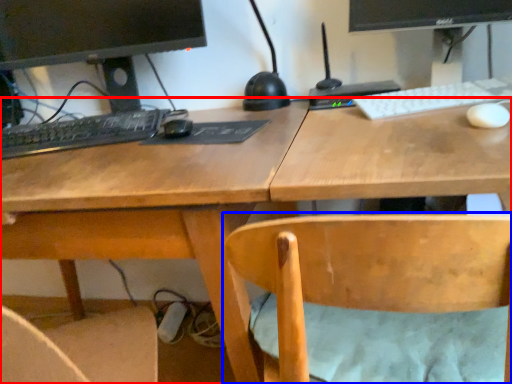
Question: Which object appears closest to the camera in this image, desk (highlighted by a red box) or chair (highlighted by a blue box)?

Choices:
 (A) desk
 (B) chair

Answer: (B)